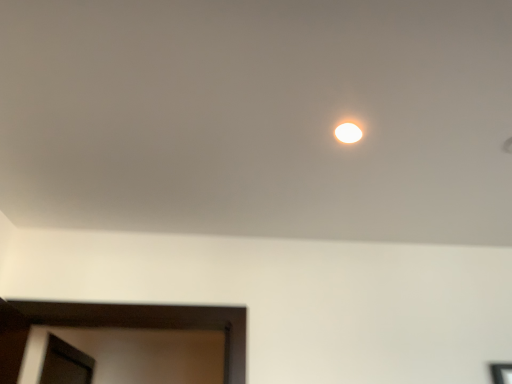
The width and height of the screenshot is (512, 384). Describe the element at coordinates (348, 133) in the screenshot. I see `white glossy droplight at upper center` at that location.

At what (x,y) coordinates should I click in order to perform the action: click on white glossy droplight at upper center. Please return your answer as a coordinate pair (x, y). Image resolution: width=512 pixels, height=384 pixels. Looking at the image, I should click on (348, 133).

What is the approximate width of white glossy droplight at upper center?

4.10 inches.

Where is `white glossy droplight at upper center`? white glossy droplight at upper center is located at coordinates (348, 133).